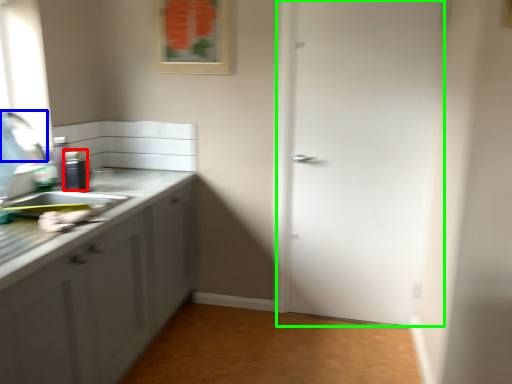
Question: Which object is positioned farthest from appliance (highlighted by a red box)? Select from faucet (highlighted by a blue box) and door (highlighted by a green box).

Choices:
 (A) faucet
 (B) door

Answer: (B)